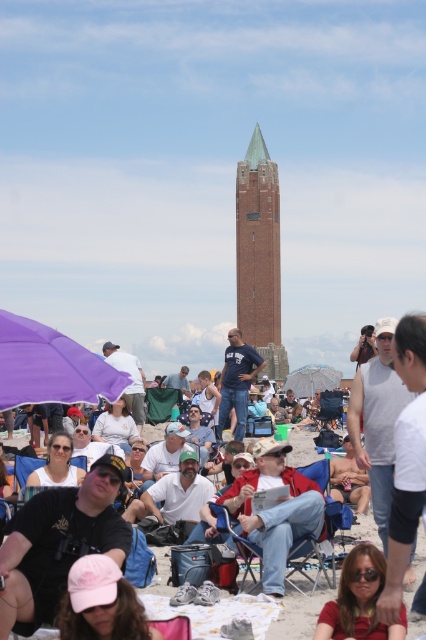
You are a photographer trying to capture a shot of the printed fabric umbrella at center and the matte pink cap at lower center. From your current position, which object should you move your camera to the left to include in the frame first?

The printed fabric umbrella at center is to the left of the matte pink cap at lower center, so you should move your camera to the left to include the printed fabric umbrella at center first.

Based on the photo, you are planning to set up a beach lounge area and need to know which item takes up more space. Based on the scene, which one is bigger between the blue fabric chair at center and the printed fabric umbrella at center?

The blue fabric chair at center has a larger size compared to the printed fabric umbrella at center, so the blue fabric chair at center takes up more space.

You are a drone operator who needs to fly a drone from the purple umbrella on the left to the brick tower at center. According to the coordinates provided, in which direction should you fly the drone first?

The brick tower at center is located at coordinates point [259,256]. Since the purple umbrella is on the left side of the frame, the drone should first fly towards the right to reach the brick tower at center.